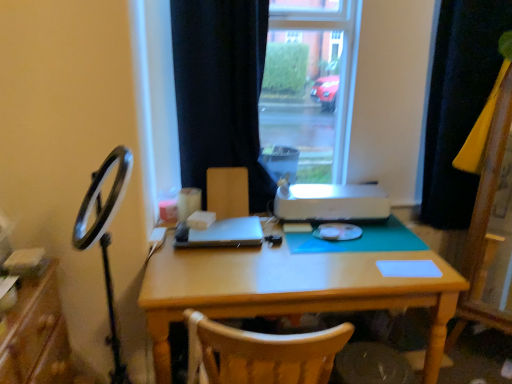
The image size is (512, 384). I want to click on empty space that is ontop of satin black laptop at center (from a real-world perspective), so click(228, 232).